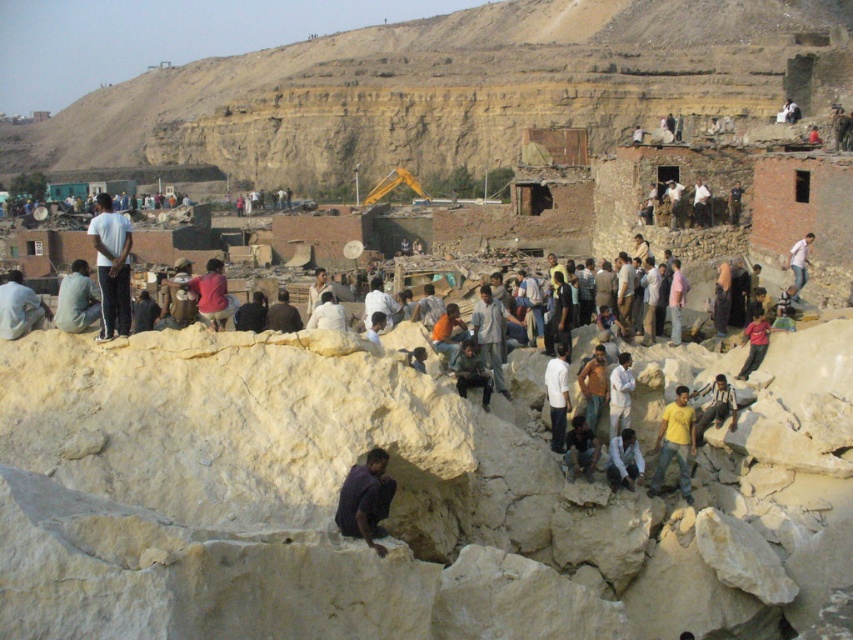
Which is in front, point (71, 269) or point (563, 458)?

Point (563, 458)

Between light brown fabric shirt at upper left and dark blue shirt at center, which one has less height?

Standing shorter between the two is dark blue shirt at center.

The height and width of the screenshot is (640, 853). I want to click on light brown fabric shirt at upper left, so click(x=76, y=300).

At what (x,y) coordinates should I click in order to perform the action: click on light brown fabric shirt at upper left. Please return your answer as a coordinate pair (x, y). The height and width of the screenshot is (640, 853). Looking at the image, I should click on (76, 300).

Does point (474, 340) lie in front of point (747, 332)?

No, it is not.

Is light gray fabric shirt at center thinner than light brown leather jacket at lower right?

No, light gray fabric shirt at center is not thinner than light brown leather jacket at lower right.

Where is `light gray fabric shirt at center`? The height and width of the screenshot is (640, 853). light gray fabric shirt at center is located at coordinates (490, 333).

Is white cotton shirt at center further to camera compared to light brown leather jacket at lower right?

No, it is not.

Is point (614, 444) positioned behind point (756, 342)?

No, (614, 444) is closer to viewer.

Identify the location of white cotton shirt at center. (624, 460).